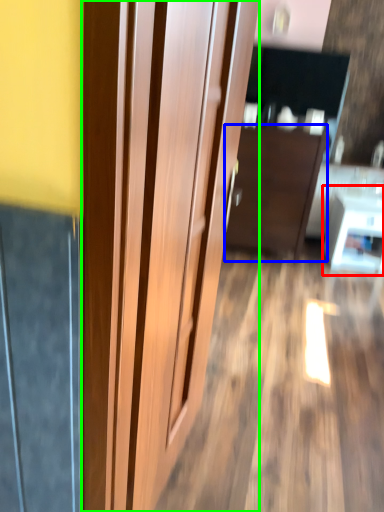
Question: Based on their relative distances, which object is nearer to table (highlighted by a red box)? Choose from furniture (highlighted by a blue box) and door (highlighted by a green box).

Choices:
 (A) furniture
 (B) door

Answer: (A)